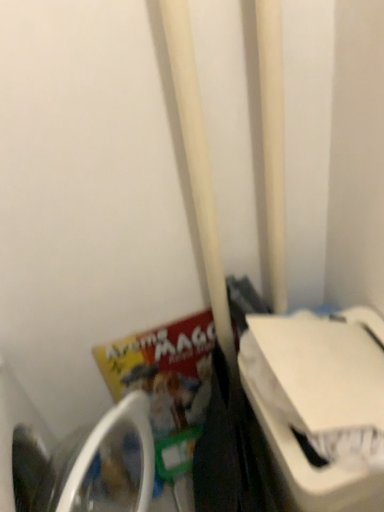
Describe the element at coordinates (319, 401) in the screenshot. I see `white plastic washing machine at right, which ranks as the 1th washing machine in right-to-left order` at that location.

Measure the distance between white matte pole at center and camera.

white matte pole at center and camera are 27.15 inches apart.

What do you see at coordinates (273, 143) in the screenshot? I see `white matte pole at center` at bounding box center [273, 143].

Find the location of a particular element. Image resolution: width=384 pixels, height=512 pixels. white plastic washing machine at right, which ranks as the 1th washing machine in right-to-left order is located at coordinates (319, 401).

This screenshot has width=384, height=512. Identify the location of washing machine that is under the white plastic washing machine at lower left, arranged as the second washing machine when viewed from the right (from a real-world perspective). (319, 401).

From the picture: Between white plastic washing machine at right, arranged as the second washing machine when viewed from the left, and white plastic washing machine at lower left, which appears as the 1th washing machine when viewed from the left, which one has larger size?

white plastic washing machine at lower left, which appears as the 1th washing machine when viewed from the left, is bigger.

From a real-world perspective, which is physically above, white plastic washing machine at right, arranged as the second washing machine when viewed from the left, or white plastic washing machine at lower left, which appears as the 1th washing machine when viewed from the left?

white plastic washing machine at lower left, which appears as the 1th washing machine when viewed from the left.

Would you say white plastic washing machine at right, arranged as the second washing machine when viewed from the left, is to the left or to the right of white plastic washing machine at lower left, which appears as the 1th washing machine when viewed from the left, in the picture?

white plastic washing machine at right, arranged as the second washing machine when viewed from the left, is positioned on white plastic washing machine at lower left, which appears as the 1th washing machine when viewed from the left,'s right side.

Considering the sizes of white matte pole at center and white plastic washing machine at right, which ranks as the 1th washing machine in right-to-left order, in the image, is white matte pole at center bigger or smaller than white plastic washing machine at right, which ranks as the 1th washing machine in right-to-left order,?

Considering their sizes, white matte pole at center takes up less space than white plastic washing machine at right, which ranks as the 1th washing machine in right-to-left order.

The height and width of the screenshot is (512, 384). There is a white matte pole at center. What are the coordinates of `the 1st washing machine below it (from the image's perspective)` in the screenshot? It's located at click(x=319, y=401).

Can you tell me how much white matte pole at center and white plastic washing machine at right, which ranks as the 1th washing machine in right-to-left order, differ in facing direction?

90 degrees.

How distant is white matte pole at center from white plastic washing machine at right, which ranks as the 1th washing machine in right-to-left order?

white matte pole at center is 12.44 inches from white plastic washing machine at right, which ranks as the 1th washing machine in right-to-left order.

Is white matte pole at center not close to matte paper book at lower left?

white matte pole at center is near matte paper book at lower left, not far away.

Which object is positioned more to the right, white matte pole at center or matte paper book at lower left?

Positioned to the right is white matte pole at center.

From a real-world perspective, which object stands above the other?

white matte pole at center.

This screenshot has width=384, height=512. Find the location of `pole above the matte paper book at lower left (from the image's perspective)`. pole above the matte paper book at lower left (from the image's perspective) is located at coordinates (273, 143).

At what (x,y) coordinates should I click in order to perform the action: click on washing machine below the matte paper book at lower left (from a real-world perspective). Please return your answer as a coordinate pair (x, y). This screenshot has width=384, height=512. Looking at the image, I should click on (319, 401).

Is matte paper book at lower left positioned before white plastic washing machine at right, which ranks as the 1th washing machine in right-to-left order?

No, matte paper book at lower left is further to the viewer.

Based on the photo, is matte paper book at lower left to the right of white plastic washing machine at right, arranged as the second washing machine when viewed from the left, from the viewer's perspective?

No, matte paper book at lower left is not to the right of white plastic washing machine at right, arranged as the second washing machine when viewed from the left.

Is matte paper book at lower left completely or partially outside of white plastic washing machine at right, arranged as the second washing machine when viewed from the left?

Yes, matte paper book at lower left is not within white plastic washing machine at right, arranged as the second washing machine when viewed from the left.

Considering the relative sizes of white matte pole at center and white plastic washing machine at lower left, which appears as the 1th washing machine when viewed from the left, in the image provided, is white matte pole at center smaller than white plastic washing machine at lower left, which appears as the 1th washing machine when viewed from the left,?

Yes.

Which object is further away from the camera, white matte pole at center or white plastic washing machine at lower left, which appears as the 1th washing machine when viewed from the left?

white matte pole at center is further from the camera.

Is white matte pole at center at the right side of white plastic washing machine at lower left, arranged as the second washing machine when viewed from the right?

Yes.

Does point (283, 252) lie behind point (52, 506)?

No, (283, 252) is closer to viewer.

Is white plastic washing machine at lower left, which appears as the 1th washing machine when viewed from the left, with white plastic washing machine at right, which ranks as the 1th washing machine in right-to-left order?

white plastic washing machine at lower left, which appears as the 1th washing machine when viewed from the left, and white plastic washing machine at right, which ranks as the 1th washing machine in right-to-left order, are clearly separated.

From a real-world perspective, who is located lower, white plastic washing machine at lower left, arranged as the second washing machine when viewed from the right, or white plastic washing machine at right, which ranks as the 1th washing machine in right-to-left order?

white plastic washing machine at right, which ranks as the 1th washing machine in right-to-left order, is physically lower.

From the image's perspective, does white plastic washing machine at lower left, which appears as the 1th washing machine when viewed from the left, appear lower than white plastic washing machine at right, which ranks as the 1th washing machine in right-to-left order?

Correct, white plastic washing machine at lower left, which appears as the 1th washing machine when viewed from the left, appears lower than white plastic washing machine at right, which ranks as the 1th washing machine in right-to-left order, in the image.

Who is smaller, white plastic washing machine at lower left, which appears as the 1th washing machine when viewed from the left, or white plastic washing machine at right, arranged as the second washing machine when viewed from the left?

With smaller size is white plastic washing machine at right, arranged as the second washing machine when viewed from the left.

Considering the points (256, 361) and (278, 175), which point is in front, point (256, 361) or point (278, 175)?

Positioned in front is point (256, 361).

From a real-world perspective, is white plastic washing machine at right, arranged as the second washing machine when viewed from the left, above or below white matte pole at center?

In terms of real-world spatial position, white plastic washing machine at right, arranged as the second washing machine when viewed from the left, is below white matte pole at center.

Does white plastic washing machine at right, which ranks as the 1th washing machine in right-to-left order, have a lesser width compared to white matte pole at center?

In fact, white plastic washing machine at right, which ranks as the 1th washing machine in right-to-left order, might be wider than white matte pole at center.

The width and height of the screenshot is (384, 512). Identify the location of washing machine in front of the white plastic washing machine at right, which ranks as the 1th washing machine in right-to-left order. (74, 457).

From a real-world perspective, starting from the white matte pole at center, which washing machine is the 2nd one below it? Please provide its 2D coordinates.

[(319, 401)]

Looking at the image, which one is located further to matte paper book at lower left, white plastic washing machine at lower left, which appears as the 1th washing machine when viewed from the left, or white plastic washing machine at right, which ranks as the 1th washing machine in right-to-left order?

The object further to matte paper book at lower left is white plastic washing machine at right, which ranks as the 1th washing machine in right-to-left order.

Based on their spatial positions, is white plastic washing machine at right, which ranks as the 1th washing machine in right-to-left order, or white matte pole at center further from matte paper book at lower left?

Based on the image, white matte pole at center appears to be further to matte paper book at lower left.

Which object lies further to the anchor point white matte pole at center, white plastic washing machine at right, arranged as the second washing machine when viewed from the left, or white plastic washing machine at lower left, which appears as the 1th washing machine when viewed from the left?

white plastic washing machine at lower left, which appears as the 1th washing machine when viewed from the left, lies further to white matte pole at center than the other object.

Looking at the image, which one is located further to white plastic washing machine at right, which ranks as the 1th washing machine in right-to-left order, white plastic washing machine at lower left, arranged as the second washing machine when viewed from the right, or white matte pole at center?

white plastic washing machine at lower left, arranged as the second washing machine when viewed from the right, is positioned further to the anchor white plastic washing machine at right, which ranks as the 1th washing machine in right-to-left order.

From the image, which object appears to be farther from matte paper book at lower left, white matte pole at center or white plastic washing machine at right, arranged as the second washing machine when viewed from the left?

The object further to matte paper book at lower left is white matte pole at center.

Looking at the image, which one is located further to matte paper book at lower left, white matte pole at center or white plastic washing machine at lower left, which appears as the 1th washing machine when viewed from the left?

white matte pole at center lies further to matte paper book at lower left than the other object.

Based on their spatial positions, is matte paper book at lower left or white plastic washing machine at right, arranged as the second washing machine when viewed from the left, further from white plastic washing machine at lower left, arranged as the second washing machine when viewed from the right?

white plastic washing machine at right, arranged as the second washing machine when viewed from the left, is further to white plastic washing machine at lower left, arranged as the second washing machine when viewed from the right.

Considering their positions, is white plastic washing machine at right, which ranks as the 1th washing machine in right-to-left order, positioned closer to white plastic washing machine at lower left, arranged as the second washing machine when viewed from the right, than white matte pole at center?

Among the two, white plastic washing machine at right, which ranks as the 1th washing machine in right-to-left order, is located nearer to white plastic washing machine at lower left, arranged as the second washing machine when viewed from the right.

This screenshot has height=512, width=384. In order to click on book between white matte pole at center and white plastic washing machine at lower left, which appears as the 1th washing machine when viewed from the left, vertically in this screenshot , I will do `click(160, 359)`.

Image resolution: width=384 pixels, height=512 pixels. In order to click on pole located between white plastic washing machine at lower left, arranged as the second washing machine when viewed from the right, and white plastic washing machine at right, which ranks as the 1th washing machine in right-to-left order, in the left-right direction in this screenshot , I will do pos(273,143).

The height and width of the screenshot is (512, 384). Find the location of `book between white matte pole at center and white plastic washing machine at right, arranged as the second washing machine when viewed from the left, in the vertical direction`. book between white matte pole at center and white plastic washing machine at right, arranged as the second washing machine when viewed from the left, in the vertical direction is located at coordinates (160, 359).

I want to click on book situated between white plastic washing machine at lower left, which appears as the 1th washing machine when viewed from the left, and white plastic washing machine at right, which ranks as the 1th washing machine in right-to-left order, from left to right, so click(160, 359).